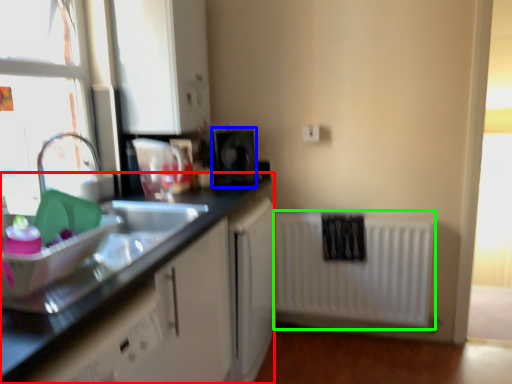
Question: Which object is positioned closest to countertop (highlighted by a red box)? Select from appliance (highlighted by a blue box) and radiator (highlighted by a green box).

Choices:
 (A) appliance
 (B) radiator

Answer: (A)